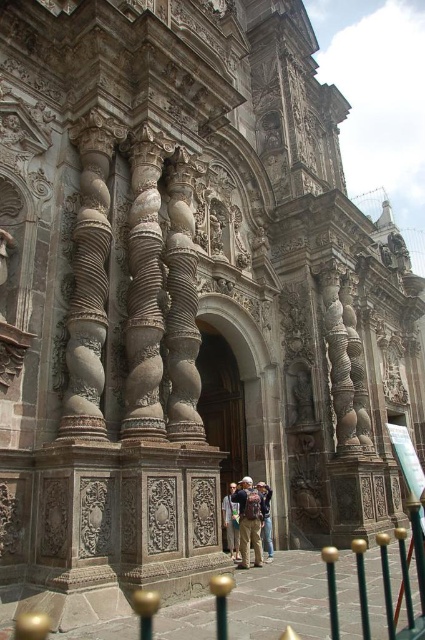
Is light brown leather backpack at center smaller than khaki cotton pants at center?

Incorrect, light brown leather backpack at center is not smaller in size than khaki cotton pants at center.

Is light brown leather backpack at center bigger than khaki cotton pants at center?

Yes.

What do you see at coordinates (249, 522) in the screenshot? I see `light brown leather backpack at center` at bounding box center [249, 522].

What are the coordinates of `light brown leather backpack at center` in the screenshot? It's located at (249, 522).

Can you confirm if khaki cotton pants at center is positioned above light brown leather jacket at center?

Yes.

Is point (223, 508) positioned behind point (271, 522)?

That is False.

Between point (237, 561) and point (265, 540), which one is positioned behind?

Positioned behind is point (265, 540).

Locate an element on the screen. Image resolution: width=425 pixels, height=640 pixels. khaki cotton pants at center is located at coordinates (231, 522).

Does light brown leather backpack at center lie behind light brown leather jacket at center?

No.

Who is positioned more to the left, light brown leather backpack at center or light brown leather jacket at center?

From the viewer's perspective, light brown leather backpack at center appears more on the left side.

The height and width of the screenshot is (640, 425). Find the location of `light brown leather backpack at center`. light brown leather backpack at center is located at coordinates pos(249,522).